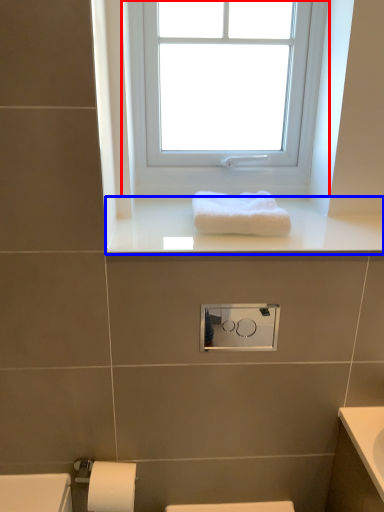
Question: Which object appears farthest to the camera in this image, window (highlighted by a red box) or window sill (highlighted by a blue box)?

Choices:
 (A) window
 (B) window sill

Answer: (A)